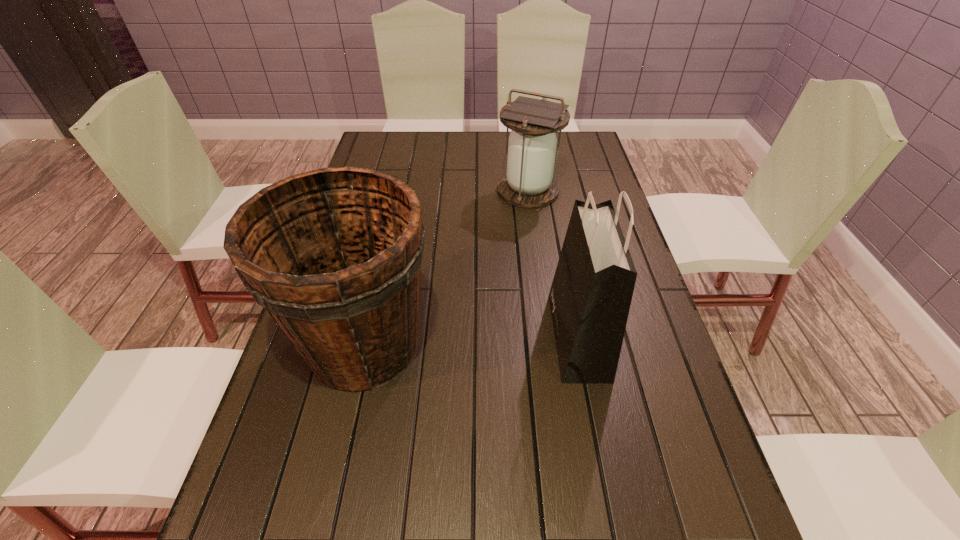
What are the coordinates of `shopping bag` in the screenshot? It's located at (591, 293).

Where is `bucket`? The height and width of the screenshot is (540, 960). bucket is located at coordinates (334, 254).

Identify the location of the farthest object. pos(529,182).

Locate an element on the screen. This screenshot has width=960, height=540. the shortest object is located at coordinates (529, 182).

I want to click on vacant region located on the front with handles of the shopping bag, so click(428, 336).

This screenshot has height=540, width=960. I want to click on free region located 0.140m on the front with handles of the shopping bag, so click(495, 336).

Find the location of `free space located 0.400m on the front with handles of the shopping bag`. free space located 0.400m on the front with handles of the shopping bag is located at coordinates (387, 336).

The height and width of the screenshot is (540, 960). Find the location of `vacant area located on the front of the leftmost object`. vacant area located on the front of the leftmost object is located at coordinates (338, 460).

Locate an element on the screen. The image size is (960, 540). free spot located on the left of the farthest object is located at coordinates (431, 190).

This screenshot has width=960, height=540. I want to click on object located at the left edge, so click(334, 254).